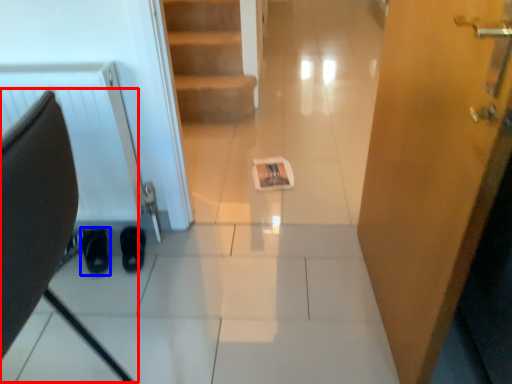
Question: Which object appears farthest to the camera in this image, swivel chair (highlighted by a red box) or footwear (highlighted by a blue box)?

Choices:
 (A) swivel chair
 (B) footwear

Answer: (B)